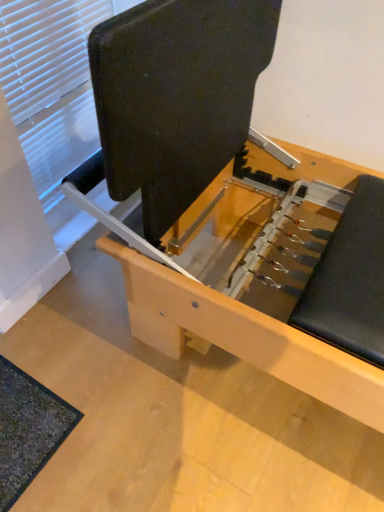
Where is `matte black bench at center`? The width and height of the screenshot is (384, 512). matte black bench at center is located at coordinates (223, 191).

The image size is (384, 512). What do you see at coordinates (52, 97) in the screenshot?
I see `white matte window at upper left` at bounding box center [52, 97].

What are the coordinates of `dark green textured mat at lower left` in the screenshot? It's located at (28, 430).

Is white matte window at upper left further to the viewer compared to dark green textured mat at lower left?

No, it is not.

In the scene shown: Is white matte window at upper left turned away from dark green textured mat at lower left?

No, white matte window at upper left is not facing the opposite direction of dark green textured mat at lower left.

Is the surface of white matte window at upper left in direct contact with dark green textured mat at lower left?

No, white matte window at upper left is not next to dark green textured mat at lower left.

From a real-world perspective, which object rests below the other?

From a 3D spatial view, dark green textured mat at lower left is below.

Can you see dark green textured mat at lower left touching white matte window at upper left?

No, dark green textured mat at lower left is not beside white matte window at upper left.

Does dark green textured mat at lower left lie in front of white matte window at upper left?

No, it is behind white matte window at upper left.

Is dark green textured mat at lower left facing towards white matte window at upper left?

No, dark green textured mat at lower left does not turn towards white matte window at upper left.

Which object is wider, dark green textured mat at lower left or white matte window at upper left?

Wider between the two is dark green textured mat at lower left.

Considering their positions, is matte black bench at center located in front of or behind white matte window at upper left?

matte black bench at center is in front of white matte window at upper left.

Based on the photo, is white matte window at upper left at the back of matte black bench at center?

No, white matte window at upper left is not at the back of matte black bench at center.

Can white matte window at upper left be found inside matte black bench at center?

Definitely not — white matte window at upper left is not inside matte black bench at center.

Considering the sizes of objects matte black bench at center and white matte window at upper left in the image provided, who is wider, matte black bench at center or white matte window at upper left?

matte black bench at center.

Is dark green textured mat at lower left situated inside matte black bench at center or outside?

dark green textured mat at lower left fits inside matte black bench at center.

Is dark green textured mat at lower left far away from matte black bench at center?

No.

Which is more to the left, dark green textured mat at lower left or matte black bench at center?

dark green textured mat at lower left.

From the image's perspective, is matte black bench at center on top of dark green textured mat at lower left?

Yes, from the image's perspective, matte black bench at center is on top of dark green textured mat at lower left.

Who is bigger, matte black bench at center or dark green textured mat at lower left?

With larger size is matte black bench at center.

Is there a large distance between matte black bench at center and dark green textured mat at lower left?

No.

Considering the positions of objects matte black bench at center and dark green textured mat at lower left in the image provided, who is in front, matte black bench at center or dark green textured mat at lower left?

matte black bench at center is more forward.

Is white matte window at upper left not within matte black bench at center?

Absolutely, white matte window at upper left is external to matte black bench at center.

From the image's perspective, who appears lower, white matte window at upper left or matte black bench at center?

matte black bench at center, from the image's perspective.

Does white matte window at upper left lie behind matte black bench at center?

Yes, it is behind matte black bench at center.

Is matte black bench at center at the back of white matte window at upper left?

No, white matte window at upper left is not facing the opposite direction of matte black bench at center.

Image resolution: width=384 pixels, height=512 pixels. Identify the location of mat behind the white matte window at upper left. (28, 430).

Find the location of `mat below the white matte window at upper left (from the image's perspective)`. mat below the white matte window at upper left (from the image's perspective) is located at coordinates (28, 430).

Looking at the image, which one is located further to white matte window at upper left, matte black bench at center or dark green textured mat at lower left?

dark green textured mat at lower left lies further to white matte window at upper left than the other object.

Considering their positions, is dark green textured mat at lower left positioned further to matte black bench at center than white matte window at upper left?

Among the two, dark green textured mat at lower left is located further to matte black bench at center.

From the image, which object appears to be nearer to matte black bench at center, white matte window at upper left or dark green textured mat at lower left?

Based on the image, white matte window at upper left appears to be nearer to matte black bench at center.

Based on their spatial positions, is white matte window at upper left or matte black bench at center further from dark green textured mat at lower left?

Based on the image, white matte window at upper left appears to be further to dark green textured mat at lower left.

Consider the image. Looking at the image, which one is located closer to dark green textured mat at lower left, matte black bench at center or white matte window at upper left?

The object closer to dark green textured mat at lower left is matte black bench at center.

Considering their positions, is dark green textured mat at lower left positioned closer to white matte window at upper left than matte black bench at center?

Among the two, matte black bench at center is located nearer to white matte window at upper left.

Image resolution: width=384 pixels, height=512 pixels. What are the coordinates of `furniture between white matte window at upper left and dark green textured mat at lower left from top to bottom` in the screenshot? It's located at (223, 191).